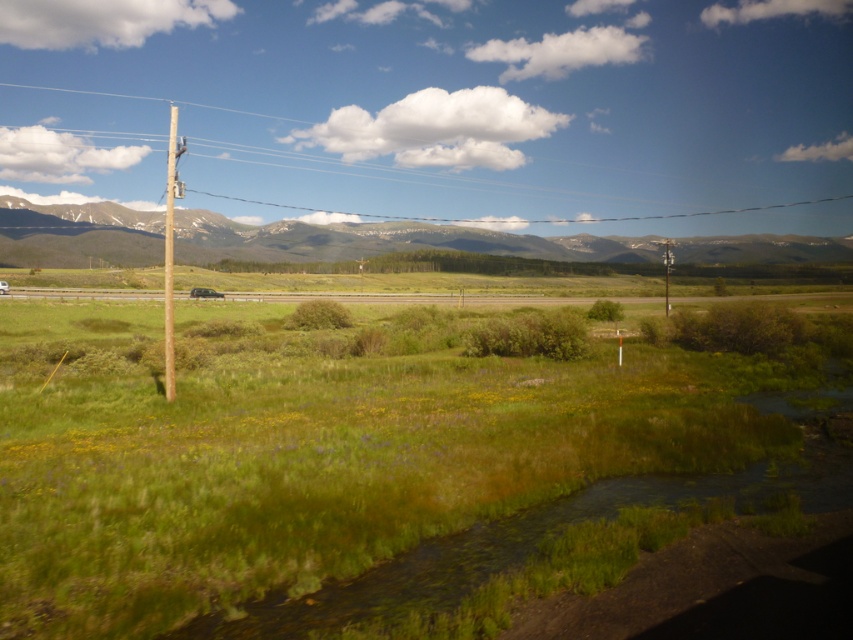
Question: Can you confirm if brown wooden telegraph pole at left is positioned to the left of matte black suv at center?

Choices:
 (A) yes
 (B) no

Answer: (A)

Question: Among these objects, which one is farthest from the camera?

Choices:
 (A) brown wooden telegraph pole at upper left
 (B) metallic gray telegraph pole at left
 (C) snowy rock mountain range at upper center

Answer: (C)

Question: Which object is positioned closest to the matte black suv at center?

Choices:
 (A) metallic gray telegraph pole at left
 (B) brown wooden telegraph pole at left
 (C) snowy rock mountain range at upper center

Answer: (A)

Question: Can you confirm if brown wooden pole at upper left is thinner than brown wooden telegraph pole at left?

Choices:
 (A) no
 (B) yes

Answer: (A)

Question: Among these objects, which one is nearest to the camera?

Choices:
 (A) snowy rock mountain range at upper center
 (B) brown wooden telegraph pole at upper left
 (C) metallic gray telegraph pole at left

Answer: (C)

Question: Does metallic gray telegraph pole at left appear over matte black suv at center?

Choices:
 (A) no
 (B) yes

Answer: (B)